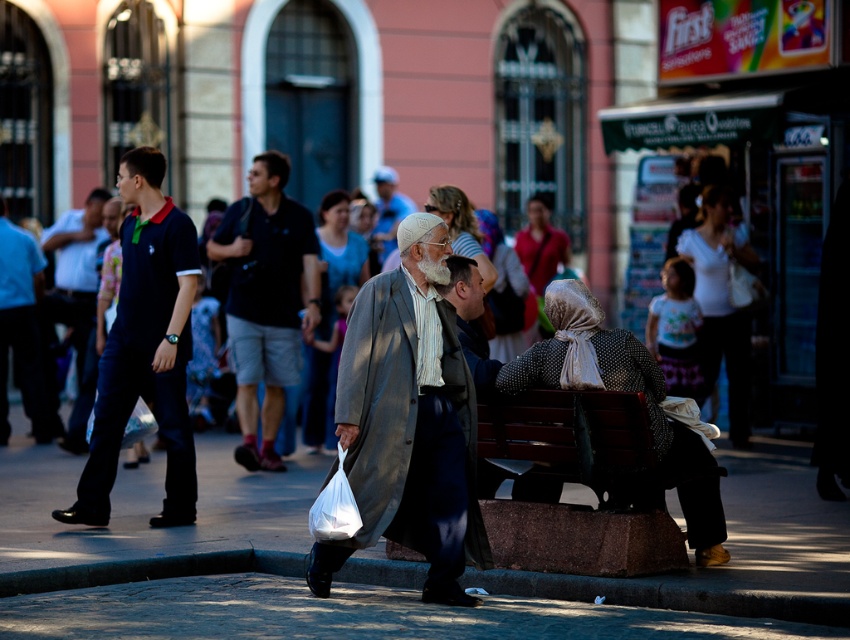
You are a photographer standing at the edge of the street. You want to take a photo that includes both the smooth concrete pavement at center and the white cotton shirt at upper right. Which object should you focus on first to ensure both are in sharp focus?

You should focus on the smooth concrete pavement at center first because it is closer to the viewer than the white cotton shirt at upper right. By focusing on the closer object, the background object will still be in acceptable focus due to the depth of field.

Based on the scene description, can you identify the object located at the coordinates point (x=721, y=305)?

The point (x=721, y=305) indicates the white cotton shirt at upper right.

You are standing at point (537, 230) and want to walk to point (639, 376). Is the path clear between these two points?

Yes, the path is clear between point (639, 376) and point (537, 230) because point (639, 376) is in front of point (537, 230).